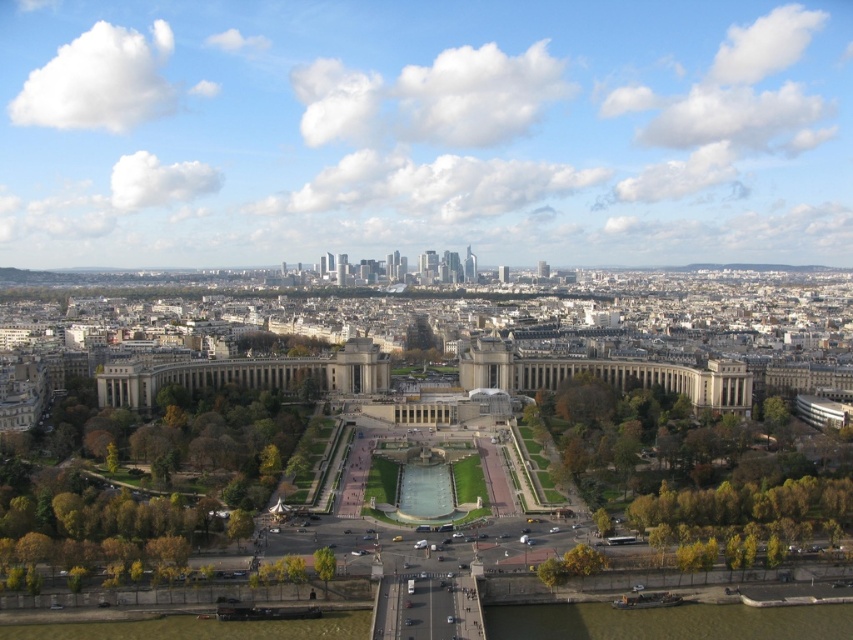
Does white marble palace at center appear under green leafy tree at lower center?

Incorrect, white marble palace at center is not positioned below green leafy tree at lower center.

Measure the distance between white marble palace at center and green leafy tree at lower center.

A distance of 93.99 meters exists between white marble palace at center and green leafy tree at lower center.

Between point (299, 372) and point (318, 552), which one is positioned behind?

Positioned behind is point (299, 372).

What are the coordinates of `white marble palace at center` in the screenshot? It's located at coord(248,374).

Based on the photo, can you confirm if green leafy trees at lower left is smaller than green leafy trees at center?

No, green leafy trees at lower left is not smaller than green leafy trees at center.

Between point (74, 545) and point (598, 493), which one is positioned in front?

Point (74, 545)

I want to click on green leafy trees at lower left, so click(x=142, y=472).

Which is behind, point (575, 403) or point (126, 368)?

Point (575, 403)

Can you confirm if green leafy trees at center is taller than white marble palace at center?

Yes, green leafy trees at center is taller than white marble palace at center.

Where is `green leafy trees at center`? This screenshot has height=640, width=853. green leafy trees at center is located at coordinates (683, 460).

The height and width of the screenshot is (640, 853). What are the coordinates of `green leafy trees at center` in the screenshot? It's located at (683, 460).